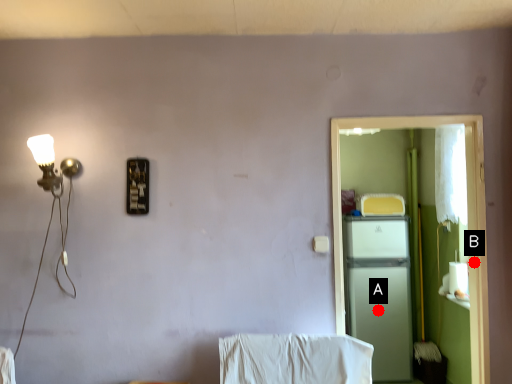
Question: Two points are circled on the image, labeled by A and B beside each circle. Which point is closer to the camera taking this photo?

Choices:
 (A) A is closer
 (B) B is closer

Answer: (B)